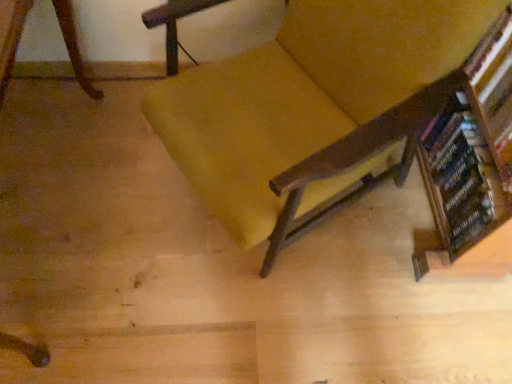
The height and width of the screenshot is (384, 512). I want to click on wooden bookshelf at right, so click(494, 92).

Where is `wooden bookcase at right`? The image size is (512, 384). wooden bookcase at right is located at coordinates (472, 169).

Is wooden bookcase at right not close to wooden bookshelf at right?

They are positioned close to each other.

Between point (453, 134) and point (509, 51), which one is positioned in front?

The point (509, 51) is in front.

Considering the sizes of objects wooden bookcase at right and wooden bookshelf at right in the image provided, who is wider, wooden bookcase at right or wooden bookshelf at right?

With larger width is wooden bookshelf at right.

Locate an element on the screen. The height and width of the screenshot is (384, 512). shelf on the right side of wooden bookcase at right is located at coordinates (494, 92).

Which of these two, wooden bookshelf at right or wooden bookcase at right, is thinner?

Thinner between the two is wooden bookcase at right.

From a real-world perspective, who is located higher, wooden bookshelf at right or wooden bookcase at right?

Answer: From a 3D spatial view, wooden bookshelf at right is above.

Find the location of a particular element. bookcase on the left of wooden bookshelf at right is located at coordinates (472, 169).

Is wooden bookshelf at right oriented towards wooden bookcase at right?

No, wooden bookshelf at right does not turn towards wooden bookcase at right.

Is wooden bookshelf at right bigger than velvet yellow chair at center?

No, wooden bookshelf at right is not bigger than velvet yellow chair at center.

Considering the positions of objects wooden bookshelf at right and velvet yellow chair at center in the image provided, who is more to the right, wooden bookshelf at right or velvet yellow chair at center?

Positioned to the right is wooden bookshelf at right.

How different are the orientations of wooden bookshelf at right and velvet yellow chair at center in degrees?

There is a 27.8-degree angle between the facing directions of wooden bookshelf at right and velvet yellow chair at center.

Considering the points (511, 93) and (170, 88), which point is behind, point (511, 93) or point (170, 88)?

The point (170, 88) is behind.

Is velvet yellow chair at center placed right next to wooden bookcase at right?

No, velvet yellow chair at center is not making contact with wooden bookcase at right.

Consider the image. Between velvet yellow chair at center and wooden bookcase at right, which one appears on the left side from the viewer's perspective?

velvet yellow chair at center.

Is velvet yellow chair at center smaller than wooden bookcase at right?

Actually, velvet yellow chair at center might be larger than wooden bookcase at right.

From the image's perspective, who appears lower, velvet yellow chair at center or wooden bookcase at right?

wooden bookcase at right.

From the image's perspective, which is below, wooden bookcase at right or velvet yellow chair at center?

wooden bookcase at right is shown below in the image.

Image resolution: width=512 pixels, height=384 pixels. In order to click on bookcase below the velvet yellow chair at center (from a real-world perspective) in this screenshot , I will do `click(472, 169)`.

From a real-world perspective, is wooden bookcase at right physically above velvet yellow chair at center?

No, from a real-world perspective, wooden bookcase at right is not on top of velvet yellow chair at center.

Is wooden bookcase at right wider than velvet yellow chair at center?

In fact, wooden bookcase at right might be narrower than velvet yellow chair at center.

In the scene shown: From the image's perspective, is velvet yellow chair at center under wooden bookshelf at right?

Yes.

Between velvet yellow chair at center and wooden bookshelf at right, which one is positioned in front?

velvet yellow chair at center is more forward.

From a real-world perspective, is velvet yellow chair at center beneath wooden bookshelf at right?

Yes, from a real-world perspective, velvet yellow chair at center is beneath wooden bookshelf at right.

I want to click on bookcase that is behind the wooden bookshelf at right, so click(x=472, y=169).

Where is `shelf that is in front of the wooden bookcase at right`? This screenshot has height=384, width=512. shelf that is in front of the wooden bookcase at right is located at coordinates (494, 92).

When comparing their distances from velvet yellow chair at center, does wooden bookshelf at right or wooden bookcase at right seem further?

wooden bookshelf at right is further to velvet yellow chair at center.

From the image, which object appears to be nearer to wooden bookcase at right, velvet yellow chair at center or wooden bookshelf at right?

Based on the image, wooden bookshelf at right appears to be nearer to wooden bookcase at right.

Considering their positions, is wooden bookcase at right positioned further to velvet yellow chair at center than wooden bookshelf at right?

wooden bookshelf at right lies further to velvet yellow chair at center than the other object.

Based on their spatial positions, is velvet yellow chair at center or wooden bookcase at right further from wooden bookshelf at right?

Based on the image, velvet yellow chair at center appears to be further to wooden bookshelf at right.

From the image, which object appears to be nearer to wooden bookshelf at right, wooden bookcase at right or velvet yellow chair at center?

wooden bookcase at right.

Considering their positions, is wooden bookshelf at right positioned further to wooden bookcase at right than velvet yellow chair at center?

Among the two, velvet yellow chair at center is located further to wooden bookcase at right.

Find the location of `bookcase located between velvet yellow chair at center and wooden bookshelf at right in the left-right direction`. bookcase located between velvet yellow chair at center and wooden bookshelf at right in the left-right direction is located at coordinates (472, 169).